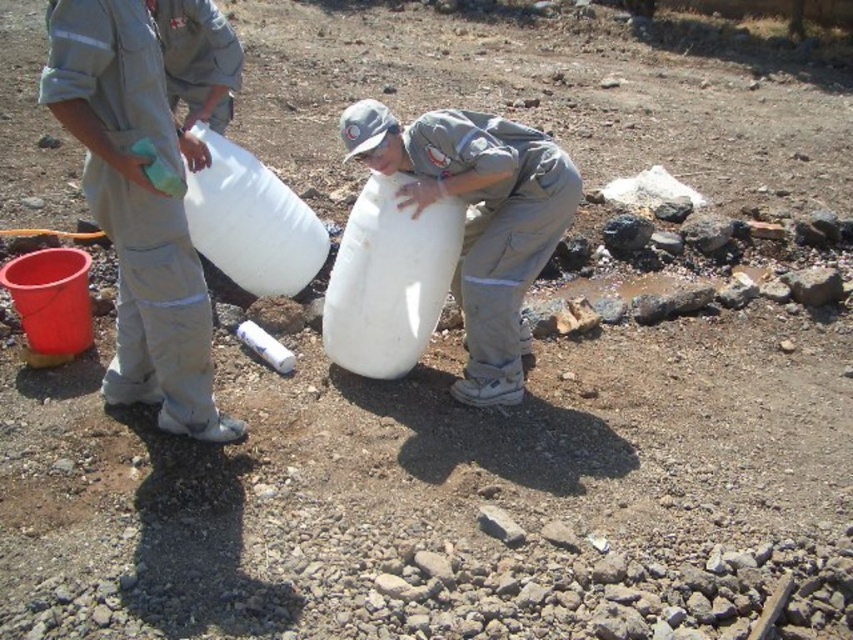
You are standing at the point labeled as point (508, 396) and want to walk to the point labeled as point (177, 272). Which direction should you face to move directly towards your destination?

You should face towards the direction of point (177, 272), which is in front of point (508, 396).

You are a supervisor observing the workers in the image. You need to ensure that the light gray uniform at left and the white matte container at center are positioned correctly for safety. According to the safety guidelines, the container must be placed to the right of the worker. Is the current arrangement compliant with the safety guidelines?

The light gray uniform at left is to the left of the white matte container at center. Since the container must be to the right of the worker, the current arrangement is compliant with the safety guidelines.

You are an observer standing in front of the scene. Which object is wider between the light gray uniform at left and the white matte container at center?

The light gray uniform at left has a lesser width compared to the white matte container at center, so the white matte container at center is wider.